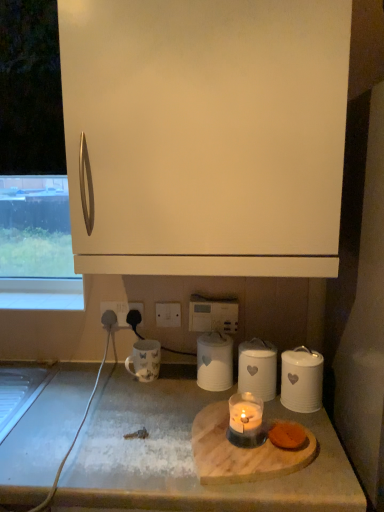
In order to click on blank space situated above wooden cutting board at center (from a real-world perspective) in this screenshot , I will do `click(236, 443)`.